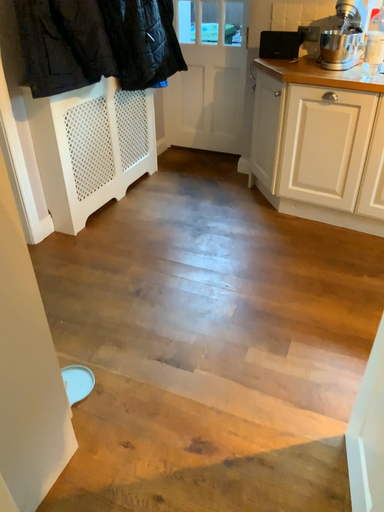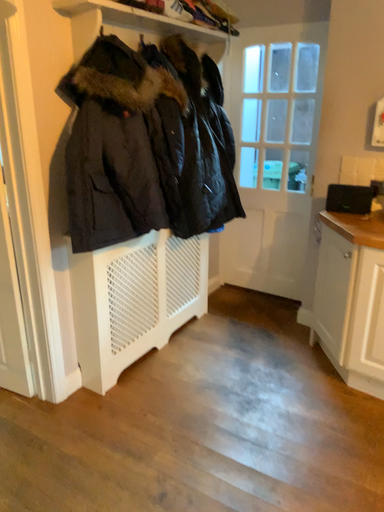
Question: Which way did the camera rotate in the video?

Choices:
 (A) rotated upward
 (B) rotated downward

Answer: (A)